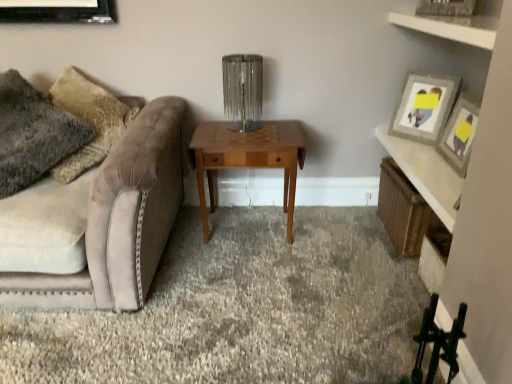
Where is `free space on the front side of clear glass table lamp at center`? The height and width of the screenshot is (384, 512). free space on the front side of clear glass table lamp at center is located at coordinates (240, 140).